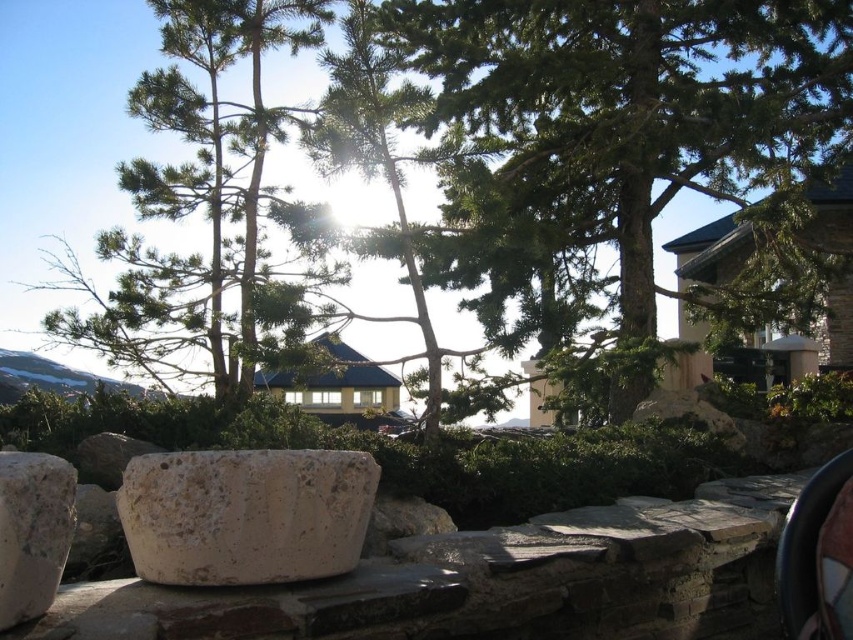
Question: Estimate the real-world distances between objects in this image. Which object is closer to the green textured tree at center?

Choices:
 (A) granite boulder at lower left
 (B) white stone boulder at center

Answer: (B)

Question: Does green textured tree at center have a greater width compared to green leafy tree at upper left?

Choices:
 (A) no
 (B) yes

Answer: (B)

Question: Which point is farther to the camera?

Choices:
 (A) (508, 216)
 (B) (44, 547)
 (C) (227, 380)

Answer: (C)

Question: Does white stone boulder at center appear on the right side of granite boulder at lower left?

Choices:
 (A) no
 (B) yes

Answer: (B)

Question: Does green textured tree at center appear on the right side of granite boulder at lower left?

Choices:
 (A) no
 (B) yes

Answer: (B)

Question: Which of these objects is positioned farthest from the white stone boulder at center?

Choices:
 (A) granite boulder at lower left
 (B) green textured tree at center

Answer: (B)